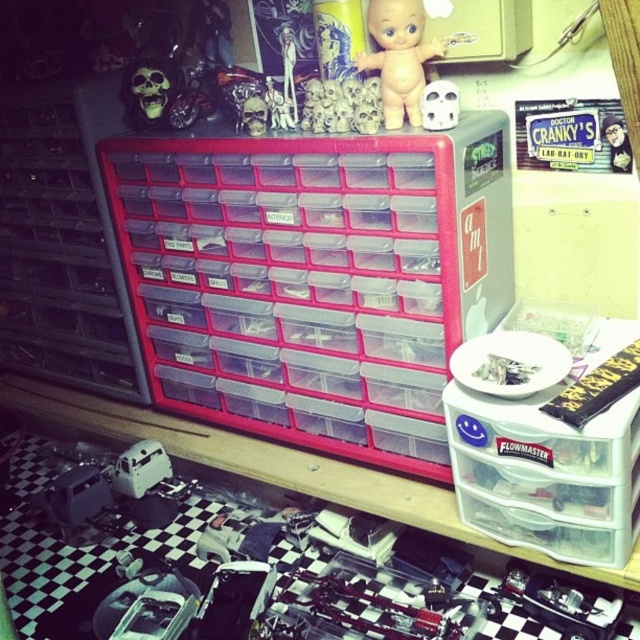
Does transparent plastic drawer at center have a lesser height compared to matte plastic skull at center?

No, transparent plastic drawer at center is not shorter than matte plastic skull at center.

Does point (129, 211) come behind point (442, 93)?

That is True.

Who is more distant from viewer, (157, 157) or (422, 115)?

The point (157, 157) is more distant.

Where is `transparent plastic drawer at center`? transparent plastic drawer at center is located at coordinates (316, 278).

Can you confirm if transparent plastic drawers at center is bigger than matte plastic skull at center?

Indeed, transparent plastic drawers at center has a larger size compared to matte plastic skull at center.

Does point (70, 344) come in front of point (428, 113)?

That is False.

Where is `transparent plastic drawers at center`? The image size is (640, 640). transparent plastic drawers at center is located at coordinates (64, 241).

Who is more forward, (392, 36) or (627, 166)?

Positioned in front is point (392, 36).

Looking at this image, is bare skin doll at upper center thinner than metallic silver toy at upper right?

No, bare skin doll at upper center is not thinner than metallic silver toy at upper right.

Is point (378, 17) closer to viewer compared to point (604, 122)?

That is True.

What are the coordinates of `bare skin doll at upper center` in the screenshot? It's located at (400, 58).